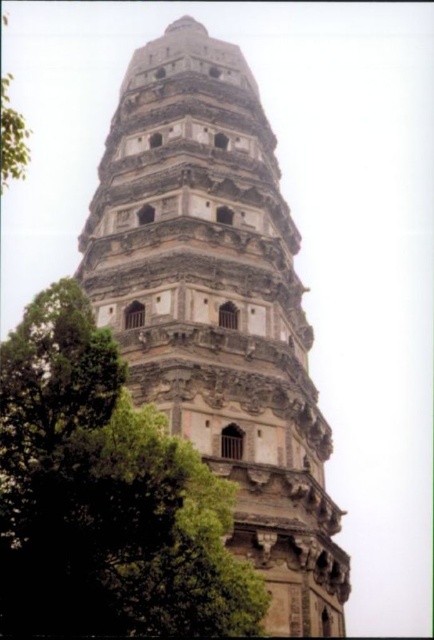
Question: Which object appears farthest from the camera in this image?

Choices:
 (A) stone tower at center
 (B) green leafy tree at center

Answer: (A)

Question: Which point appears closest to the camera in this image?

Choices:
 (A) (233, 212)
 (B) (170, 520)

Answer: (B)

Question: Can you confirm if stone tower at center is positioned to the left of green leafy tree at center?

Choices:
 (A) no
 (B) yes

Answer: (A)

Question: Which point is closer to the camera taking this photo?

Choices:
 (A) (174, 234)
 (B) (25, 438)

Answer: (B)

Question: Can you confirm if stone tower at center is bigger than green leafy tree at center?

Choices:
 (A) yes
 (B) no

Answer: (A)

Question: Is stone tower at center thinner than green leafy tree at center?

Choices:
 (A) no
 (B) yes

Answer: (A)